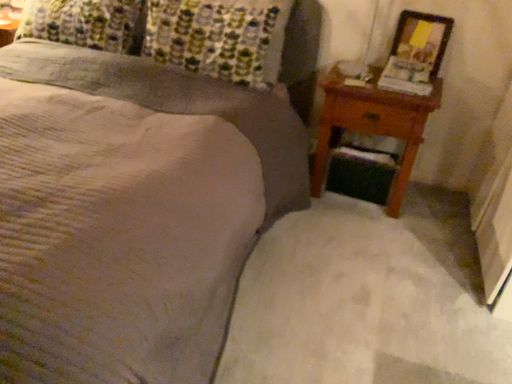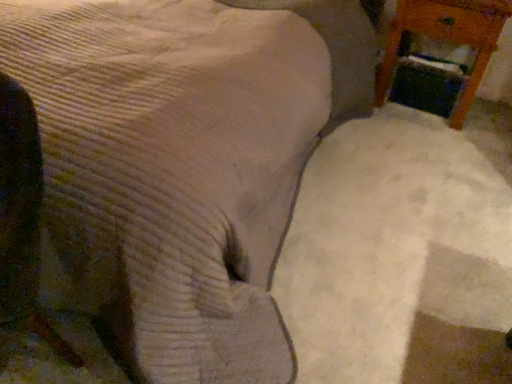
Question: How did the camera likely rotate when shooting the video?

Choices:
 (A) rotated upward
 (B) rotated downward

Answer: (B)